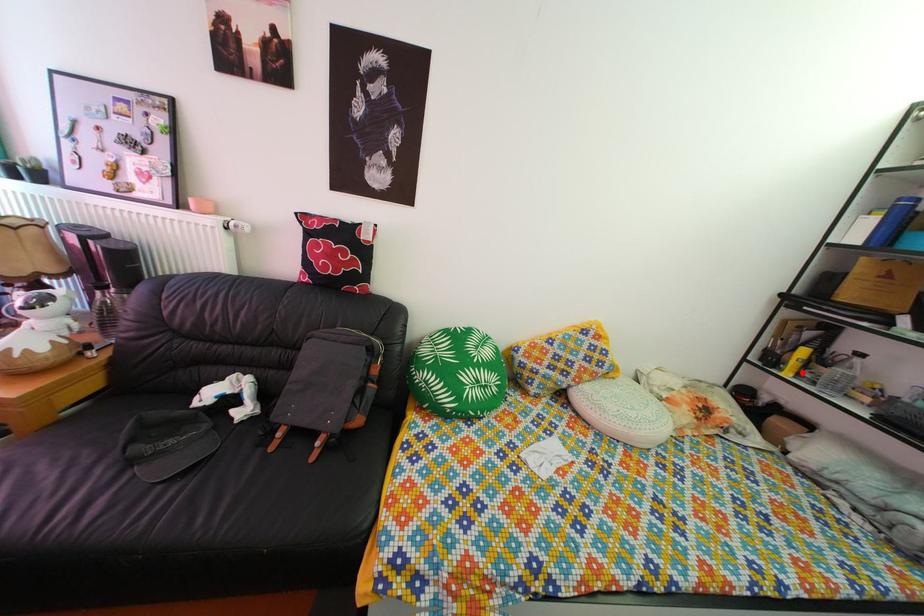
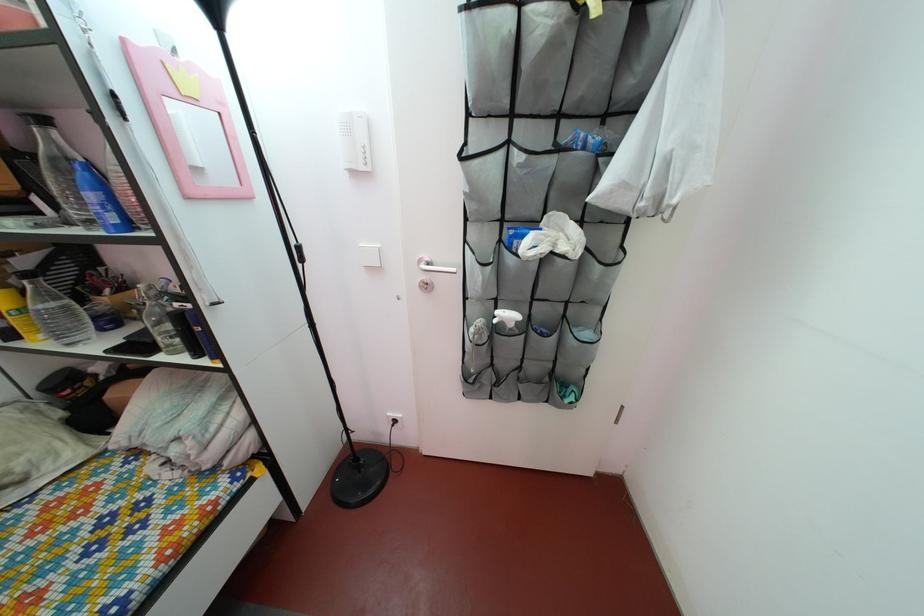
The point at the highlighted location is marked in the first image. Where is the corresponding point in the second image?

(27, 330)